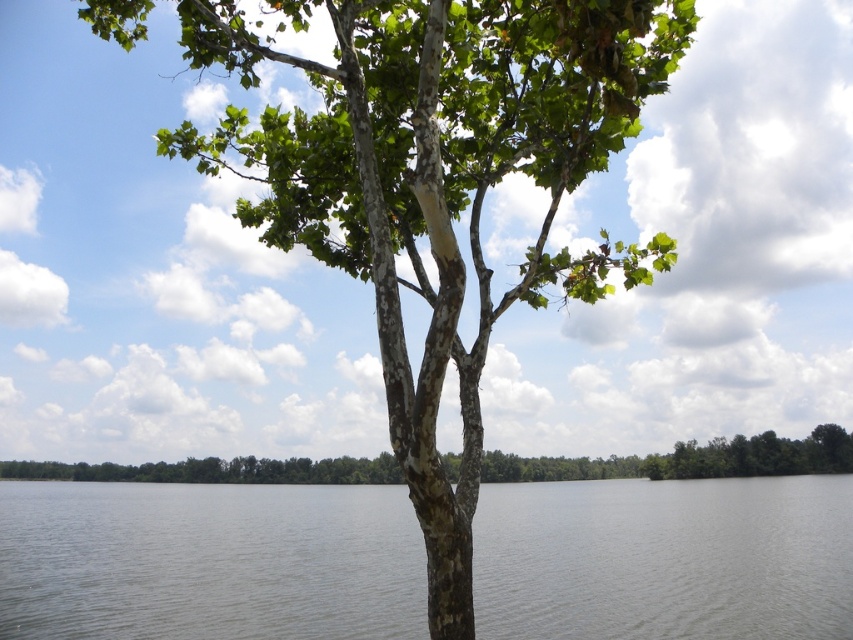
You are standing at the base of the smooth bark tree trunk at center and want to throw a pebble to the water in the background. If the distance between you and the water is 4.38 meters, will the pebble reach the water if you can throw it 5 meters?

The distance between the smooth bark tree trunk at center and the water is 4.38 meters. Since you can throw the pebble 5 meters, which is farther than 4.38 meters, the pebble will reach the water.

You are standing in a forest and see the green bark tree at center and the smooth bark tree trunk at center. Which tree is taller?

The smooth bark tree trunk at center is taller than the green bark tree at center.

You are standing in the natural landscape scene. You see the smooth bark tree at center and the gray water at center. Which object is closer to you?

The gray water at center is closer to you because the smooth bark tree at center is behind it.